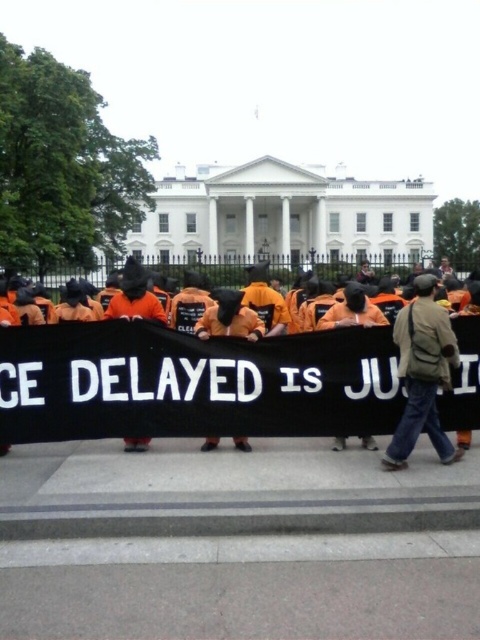
Question: Among these points, which one is nearest to the camera?

Choices:
 (A) (167, 413)
 (B) (432, 320)

Answer: (B)

Question: Is orange fabric at center further to camera compared to brown fabric jacket at center?

Choices:
 (A) yes
 (B) no

Answer: (A)

Question: Which point is closer to the camera taking this photo?

Choices:
 (A) (404, 445)
 (B) (283, 413)

Answer: (A)

Question: Is orange fabric at center further to the viewer compared to brown fabric jacket at center?

Choices:
 (A) yes
 (B) no

Answer: (A)

Question: Does orange fabric at center lie in front of brown fabric jacket at center?

Choices:
 (A) yes
 (B) no

Answer: (B)